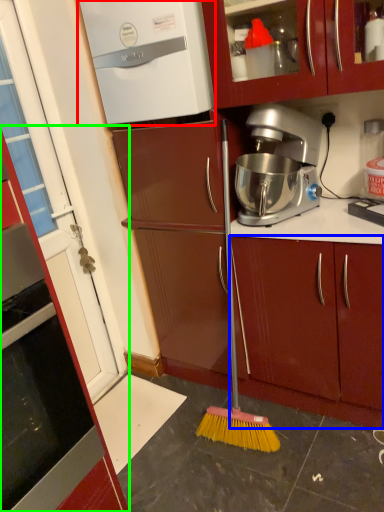
Question: Which object is positioned farthest from home appliance (highlighted by a red box)? Select from cabinetry (highlighted by a blue box) and cabinetry (highlighted by a green box).

Choices:
 (A) cabinetry
 (B) cabinetry

Answer: (B)